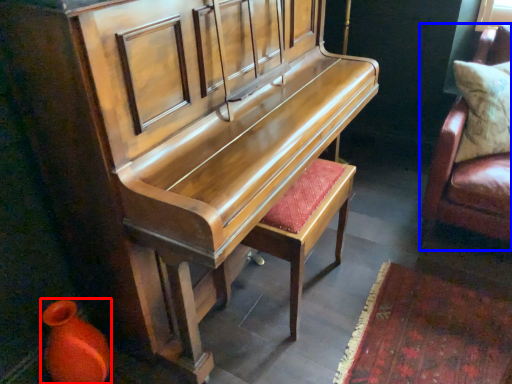
Question: Which object appears closest to the camera in this image, vase (highlighted by a red box) or furniture (highlighted by a blue box)?

Choices:
 (A) vase
 (B) furniture

Answer: (A)